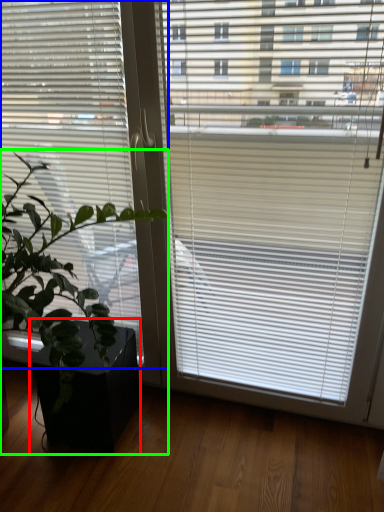
Question: Based on their relative distances, which object is nearer to flowerpot (highlighted by a red box)? Choose from window blind (highlighted by a blue box) and houseplant (highlighted by a green box).

Choices:
 (A) window blind
 (B) houseplant

Answer: (B)